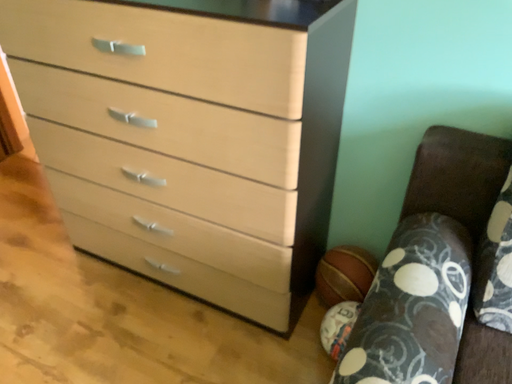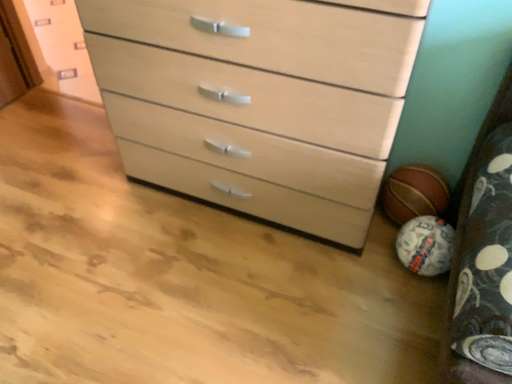
Question: How did the camera likely rotate when shooting the video?

Choices:
 (A) rotated upward
 (B) rotated downward

Answer: (B)